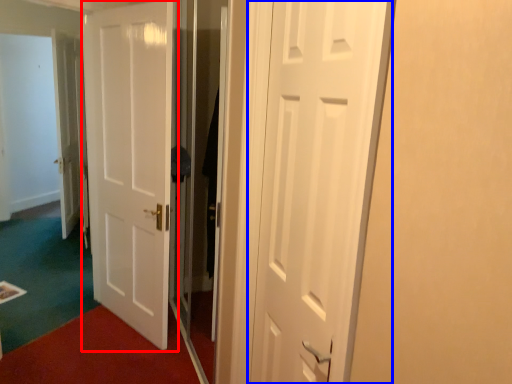
Question: Which object appears farthest to the camera in this image, door (highlighted by a red box) or door (highlighted by a blue box)?

Choices:
 (A) door
 (B) door

Answer: (A)